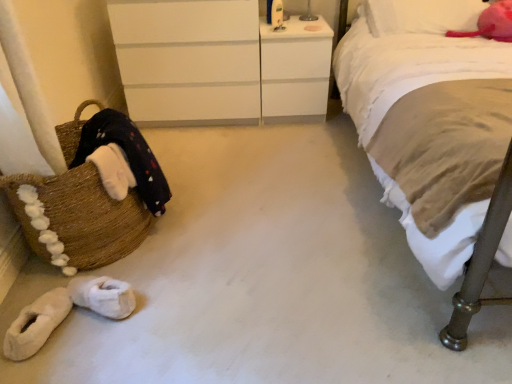
Where is `vacant space in front of white fluffy slippers at lower left, which is the second footwear in right-to-left order`? vacant space in front of white fluffy slippers at lower left, which is the second footwear in right-to-left order is located at coordinates (41, 370).